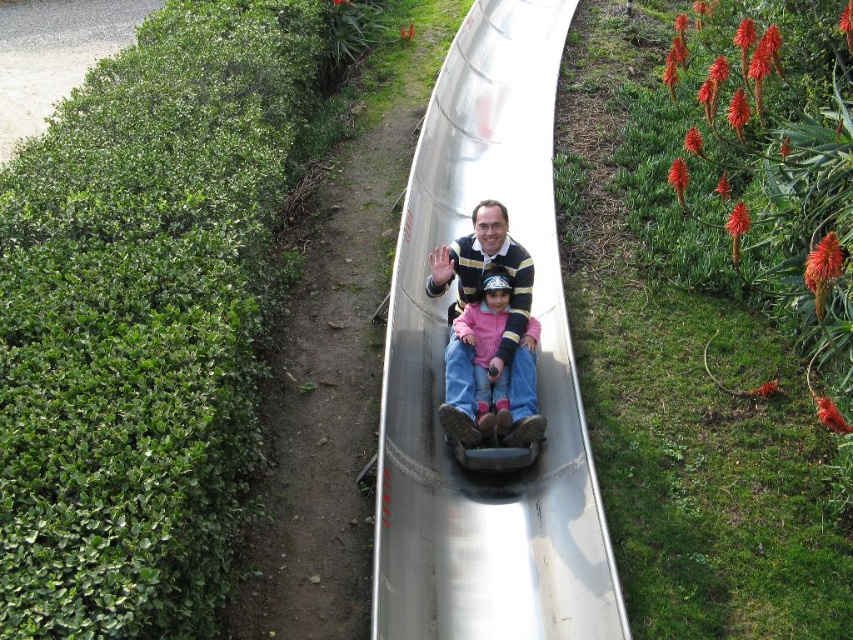
You are a maintenance worker needing to reach the metallic smooth slide at center from the green leafy hedge at left. The tools you carry require a minimum clearance of 6 meters to safely operate. Can you safely operate your tools between them?

The distance between the green leafy hedge at left and the metallic smooth slide at center is 5.90 meters, which is less than the required 6 meters clearance. Therefore, you cannot safely operate your tools between them.

You are designing a garden layout and want to place a new decorative rock garden between the green leafy hedge at left and the matte pink sweater at center. Which object should the rock garden be closer to if you want it to take up more space?

The rock garden should be closer to the matte pink sweater at center because it occupies more space than the green leafy hedge at left, allowing the rock garden to utilize the available area effectively.

You are standing at the point labeled as point (x=376, y=604) and want to take a photo of the two people on the slide with your camera. If the camera is 4.26 meters away from the point, will you be able to capture both people in the frame?

Yes, since the camera is 4.26 meters away from point (x=376, y=604), and both people are on the slide at that point, they should be within the camera frame.